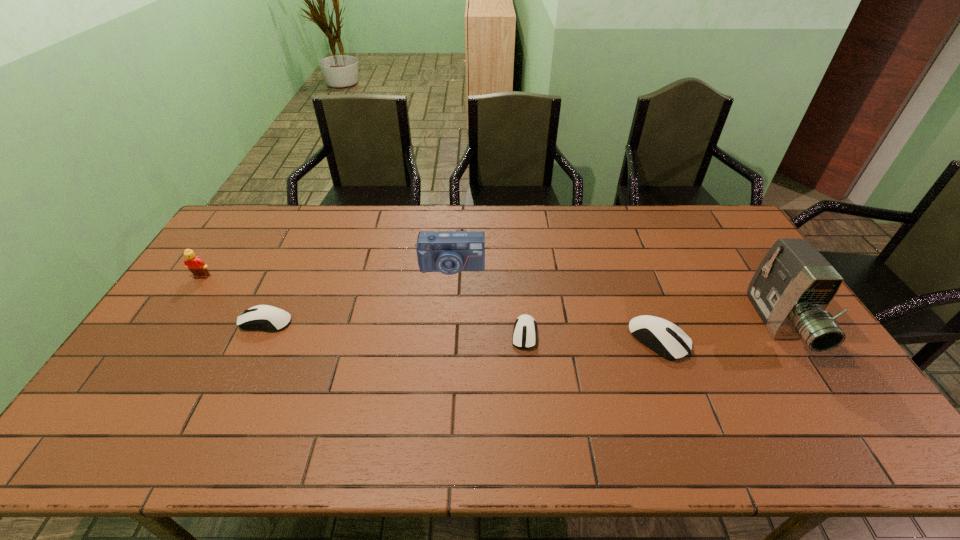
You are a GUI agent. You are given a task and a screenshot of the screen. Output one action in this format:
    pyautogui.click(x=<x>, y=<y>)
    Task: Click on the vacant space that is in between the rightmost mouse and the Lego
    Image resolution: width=960 pixels, height=540 pixels.
    Given the screenshot: What is the action you would take?
    (x=430, y=308)

At what (x,y) coordinates should I click in order to perform the action: click on object that stands as the fourth closest to the fifth object from left to right. Please return your answer as a coordinate pair (x, y). The width and height of the screenshot is (960, 540). Looking at the image, I should click on (261, 317).

What are the coordinates of `the second closest object to the rightmost mouse` in the screenshot? It's located at (x=524, y=332).

Point out which mouse is positioned as the nearest to the rightmost mouse. Please provide its 2D coordinates. Your answer should be formatted as a tuple, i.e. [(x, y)], where the tuple contains the x and y coordinates of a point satisfying the conditions above.

[(524, 332)]

Select which mouse appears as the third closest to the third tallest object. Please provide its 2D coordinates. Your answer should be formatted as a tuple, i.e. [(x, y)], where the tuple contains the x and y coordinates of a point satisfying the conditions above.

[(662, 336)]

This screenshot has height=540, width=960. Identify the location of vacant space that satisfies the following two spatial constraints: 1. on the lens of the shortest mouse; 2. on the right side of the camera. (446, 334).

The image size is (960, 540). I want to click on free spot that satisfies the following two spatial constraints: 1. on the front side of the second mouse from right to left; 2. on the left side of the second shortest mouse, so click(260, 334).

The height and width of the screenshot is (540, 960). I want to click on vacant space that satisfies the following two spatial constraints: 1. on the face of the rightmost mouse; 2. on the right side of the Lego, so click(x=159, y=340).